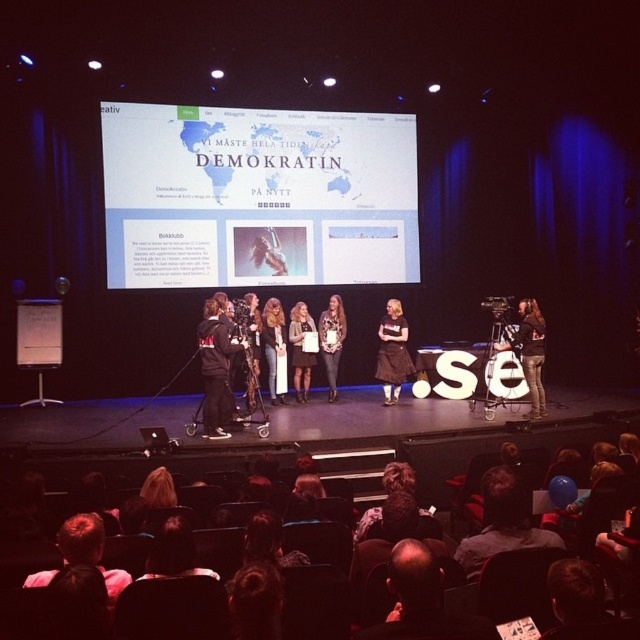
Is white paper at center smaller than black leather jacket at center?

Incorrect, white paper at center is not smaller in size than black leather jacket at center.

Is white paper at center shorter than black leather jacket at center?

No.

Which is in front, point (241, 214) or point (497, 342)?

Point (497, 342) is more forward.

Find the location of a particular element. The width and height of the screenshot is (640, 640). white paper at center is located at coordinates (257, 196).

Is black leather jacket at center shorter than brown fabric skirt at center?

Yes, black leather jacket at center is shorter than brown fabric skirt at center.

Who is more forward, (541,412) or (392,330)?

Positioned in front is point (541,412).

Between point (531, 408) and point (404, 349), which one is positioned in front?

Positioned in front is point (531, 408).

Locate an element on the screen. black leather jacket at center is located at coordinates (529, 353).

Who is positioned more to the left, white paper at center or leather jacket at center?

white paper at center

Is white paper at center shorter than leather jacket at center?

No.

In order to click on white paper at center in this screenshot , I will do `click(257, 196)`.

In order to click on white paper at center in this screenshot , I will do `click(257, 196)`.